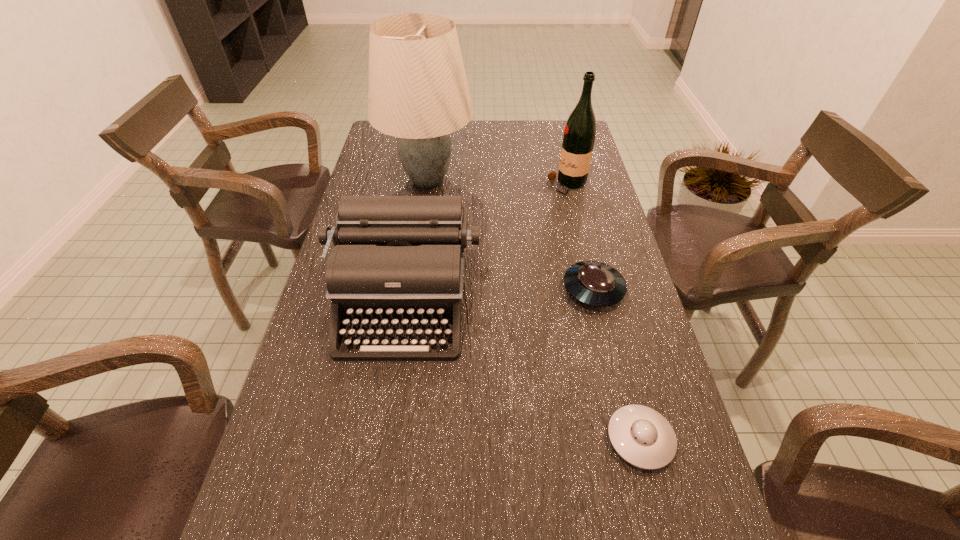
Find the location of a particular element. free space located 0.390m on the back of the fourth tallest object is located at coordinates (568, 185).

The width and height of the screenshot is (960, 540). I want to click on free space located 0.310m on the left of the shortest object, so click(449, 438).

This screenshot has width=960, height=540. In order to click on lampshade at the left edge in this screenshot , I will do `click(418, 92)`.

This screenshot has width=960, height=540. I want to click on typewriter that is at the left edge, so click(397, 261).

Where is `wine bottle situated at the right edge`? The width and height of the screenshot is (960, 540). wine bottle situated at the right edge is located at coordinates (579, 135).

This screenshot has width=960, height=540. Find the location of `vacant space at the far edge`. vacant space at the far edge is located at coordinates coord(481,120).

Identify the location of vacant point at the left edge. (392, 180).

In order to click on free region at the right edge in this screenshot , I will do `click(589, 253)`.

I want to click on free space at the far right corner of the desktop, so click(542, 133).

The height and width of the screenshot is (540, 960). I want to click on free space between the fourth tallest object and the wine bottle, so click(581, 237).